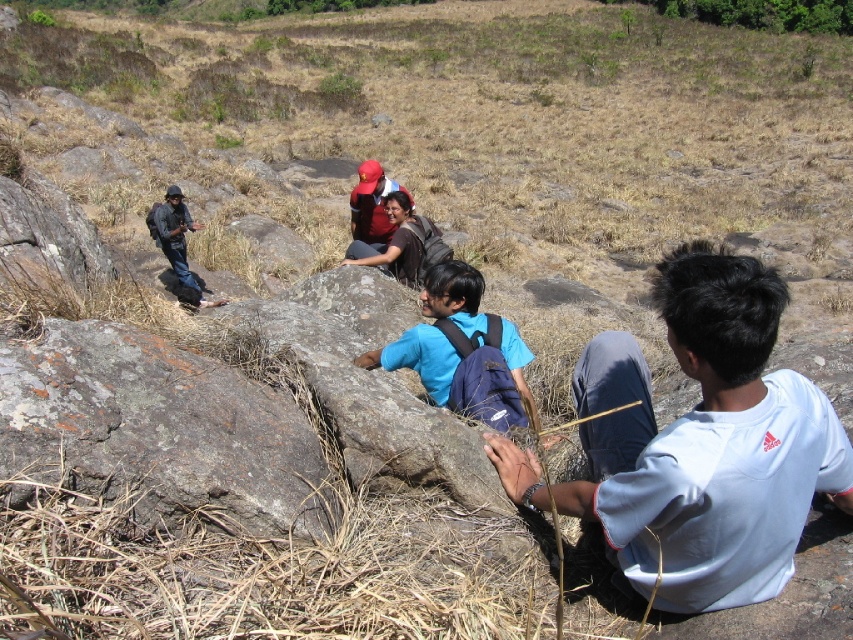
You are a hiker navigating the rocky terrain and need to reach a landmark located at point (38, 422). There is a large boulder at point (753, 380) blocking your path. Can you walk around it to reach your destination?

Point (753, 380) is in front of point (38, 422), so the large boulder at point (753, 380) is blocking the direct path. You can walk around it to reach point (38, 422).

Consider the image. You are a photographer aiming to capture a clear shot of the blue fabric backpack at center without the white cotton shirt at lower right blocking it. Based on the scene, what adjustment should you make to your camera position?

The white cotton shirt at lower right is in front of the blue fabric backpack at center. To avoid blocking the backpack, move your camera position backward so that the backpack comes into focus behind the shirt.

You are a hiker trying to locate your belongings. You see the white cotton shirt at lower right and the blue fabric backpack at center. Are they close enough for you to quickly grab both without moving more than 4 feet?

The white cotton shirt at lower right and blue fabric backpack at center are 3.80 feet apart, so yes, they are within 4 feet of each other, allowing you to grab both without moving more than 4 feet.